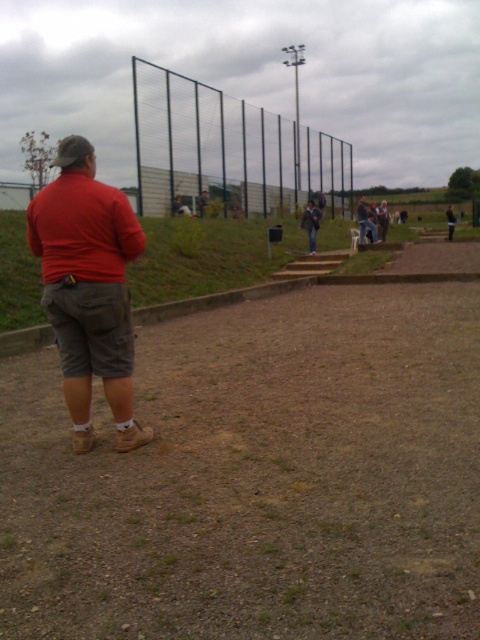
Question: Which point is closer to the camera?

Choices:
 (A) (177, 195)
 (B) (252, 614)

Answer: (B)

Question: Observing the image, what is the correct spatial positioning of matte red shirt at center in reference to light brown leather jacket at upper center?

Choices:
 (A) right
 (B) left

Answer: (B)

Question: Is green wire mesh fence at upper center bigger than dark gray fabric jacket at center?

Choices:
 (A) no
 (B) yes

Answer: (B)

Question: Which point is closer to the camera taking this photo?

Choices:
 (A) (309, 200)
 (B) (127, 374)

Answer: (B)

Question: Is brown gravel dirt track at center behind light brown leather jacket at upper center?

Choices:
 (A) no
 (B) yes

Answer: (A)

Question: Which point is farther to the camera?

Choices:
 (A) (85, 371)
 (B) (27, 598)
 (C) (311, 236)

Answer: (C)